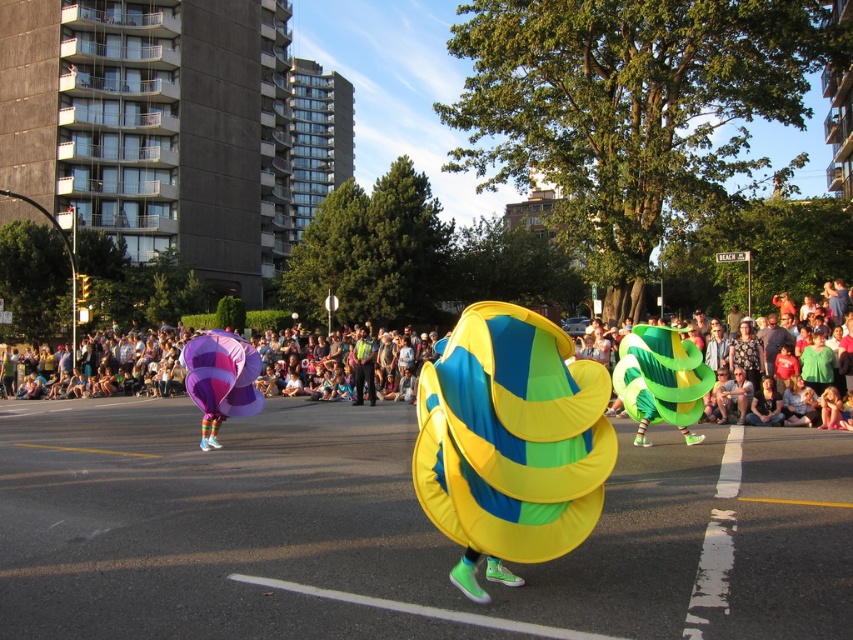
Is yellow-green fabric balloon at center wider than purple glossy balloon at center?

Correct, the width of yellow-green fabric balloon at center exceeds that of purple glossy balloon at center.

Who is more forward, (448, 532) or (195, 339)?

Point (448, 532) is in front.

Between point (457, 403) and point (184, 349), which one is positioned behind?

Positioned behind is point (184, 349).

Identify the location of yellow-green fabric balloon at center. The width and height of the screenshot is (853, 640). (512, 436).

Image resolution: width=853 pixels, height=640 pixels. I want to click on yellow-green fabric balloon at center, so click(512, 436).

The height and width of the screenshot is (640, 853). In order to click on yellow-green fabric balloon at center in this screenshot , I will do `click(512, 436)`.

Is green matte balloon at center bigger than purple glossy balloon at center?

Yes.

Is point (664, 417) positioned behind point (244, 384)?

No, (664, 417) is in front of (244, 384).

The height and width of the screenshot is (640, 853). Identify the location of green matte balloon at center. (660, 376).